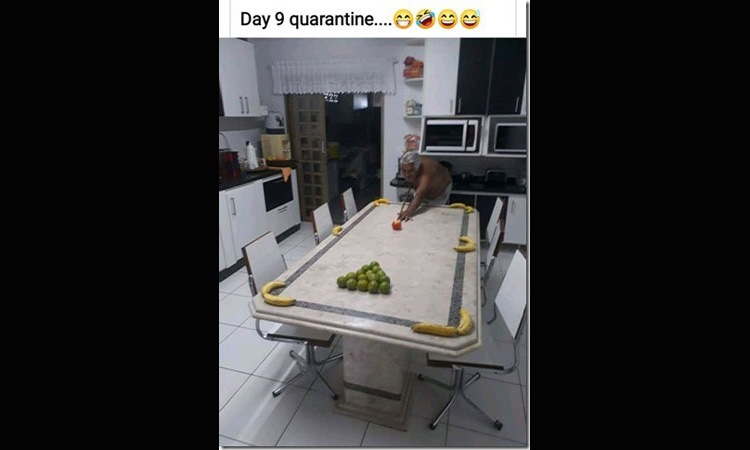
The width and height of the screenshot is (750, 450). I want to click on doorway, so click(356, 132).